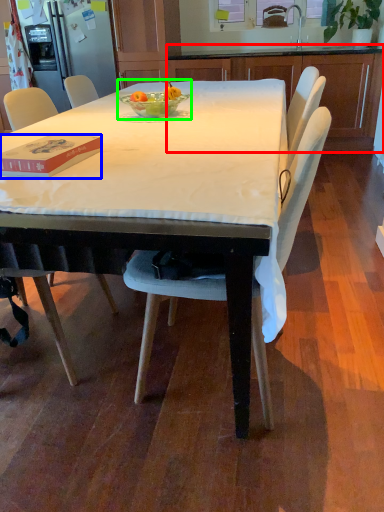
Question: Which object is positioned closest to cabinetry (highlighted by a red box)? Select from box (highlighted by a blue box) and fruit dish (highlighted by a green box).

Choices:
 (A) box
 (B) fruit dish

Answer: (B)